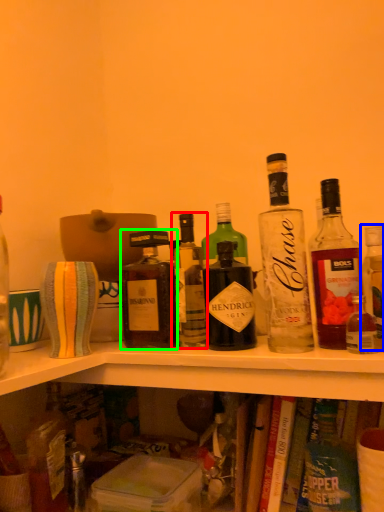
Question: Based on their relative distances, which object is nearer to bottle (highlighted by a red box)? Choose from bottle (highlighted by a blue box) and bottle (highlighted by a green box).

Choices:
 (A) bottle
 (B) bottle

Answer: (B)